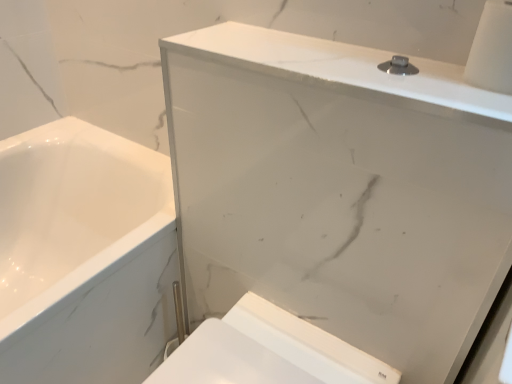
Question: Is white marble medicine cabinet at upper center taller or shorter than white glossy toilet at lower right?

Choices:
 (A) tall
 (B) short

Answer: (A)

Question: Does point (274, 190) appear closer or farther from the camera than point (261, 337)?

Choices:
 (A) farther
 (B) closer

Answer: (B)

Question: From the image's perspective, relative to white glossy toilet at lower right, is white marble medicine cabinet at upper center above or below?

Choices:
 (A) above
 (B) below

Answer: (A)

Question: From the image's perspective, is white glossy toilet at lower right positioned above or below white marble medicine cabinet at upper center?

Choices:
 (A) below
 (B) above

Answer: (A)

Question: Based on their sizes in the image, would you say white glossy toilet at lower right is bigger or smaller than white marble medicine cabinet at upper center?

Choices:
 (A) small
 (B) big

Answer: (A)

Question: Would you say white glossy toilet at lower right is inside or outside white marble medicine cabinet at upper center?

Choices:
 (A) outside
 (B) inside

Answer: (A)

Question: From a real-world perspective, is white glossy toilet at lower right physically located above or below white marble medicine cabinet at upper center?

Choices:
 (A) below
 (B) above

Answer: (A)